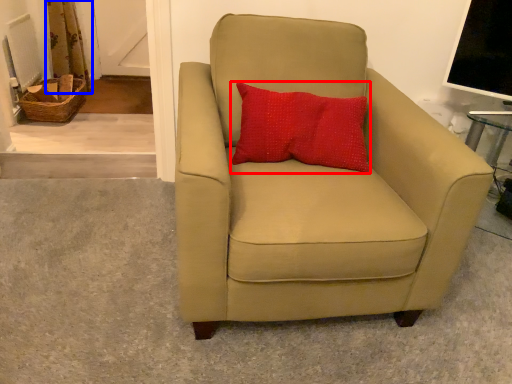
Question: Which object appears closest to the camera in this image, pillow (highlighted by a red box) or curtain (highlighted by a blue box)?

Choices:
 (A) pillow
 (B) curtain

Answer: (A)